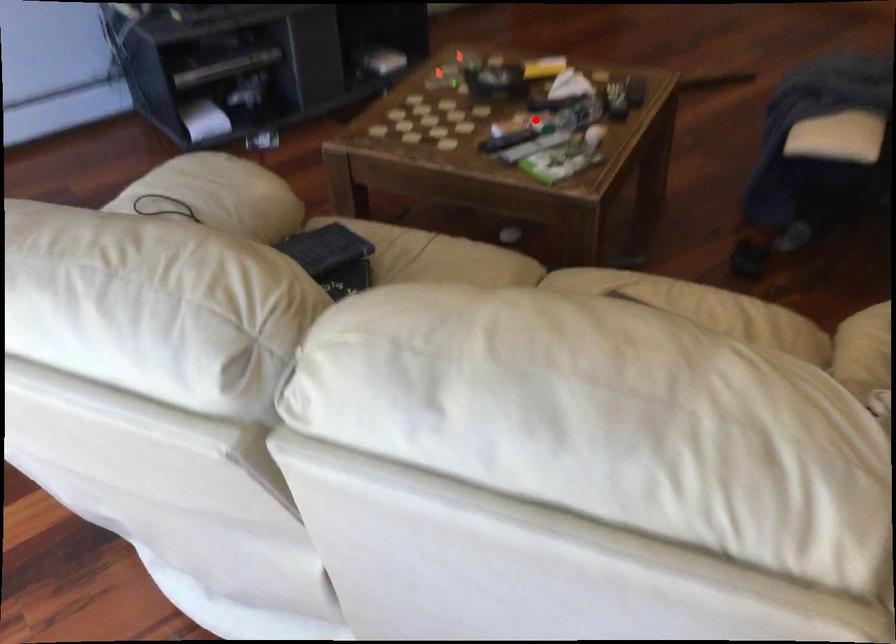
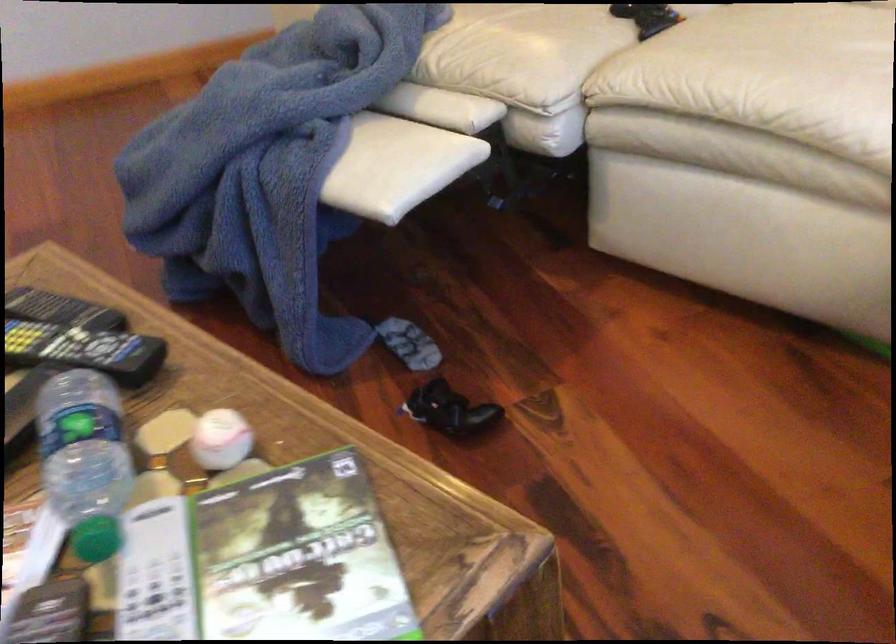
Question: I am providing you with two images of the same scene from different viewpoints. In image1, a red point is highlighted. Considering the same 3D point in image2, which of the following is correct?

Choices:
 (A) It is closer
 (B) It is farther

Answer: (A)